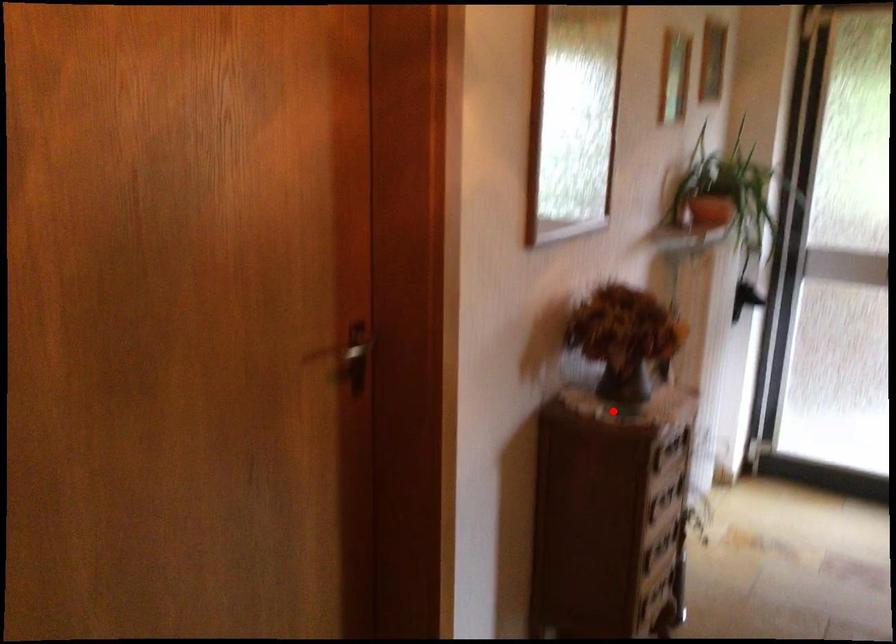
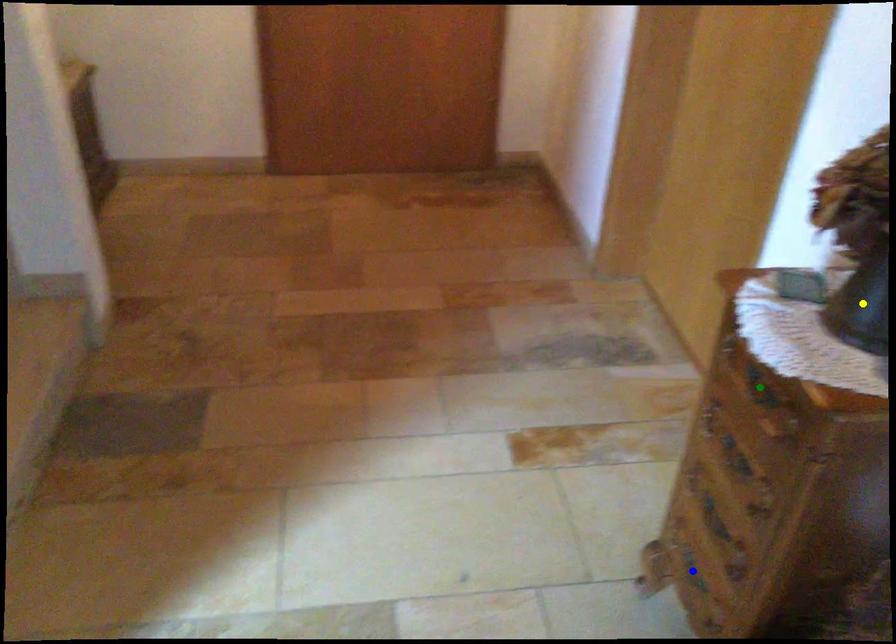
Question: I am providing you with two images of the same scene from different viewpoints. A red point is marked on the first image. You are given multiple points on the second image. Which point in image 2 is actually the same real-world point as the red point in image 1?

Choices:
 (A) yellow point
 (B) blue point
 (C) green point

Answer: (A)